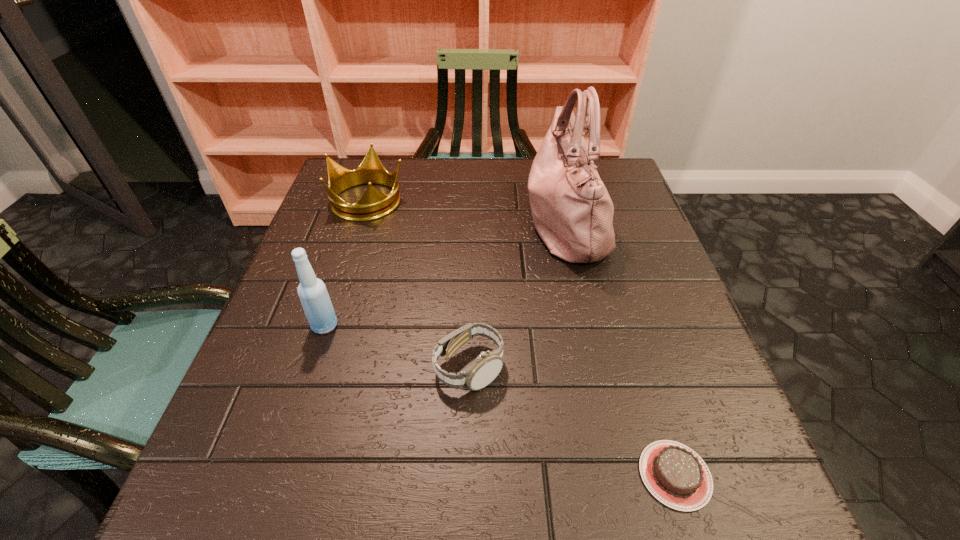
Find the location of a particular element. This screenshot has width=960, height=540. handbag that is at the right edge is located at coordinates (572, 211).

Image resolution: width=960 pixels, height=540 pixels. Identify the location of chocolate cake that is at the right edge. (677, 476).

I want to click on object present at the far left corner, so coord(373,204).

Where is `object present at the far right corner`? This screenshot has width=960, height=540. object present at the far right corner is located at coordinates (572, 211).

Identify the location of object located at the near right corner. (677, 476).

Identify the location of vacant space at the far edge of the desktop. (501, 194).

Locate an element on the screen. vacant space at the near edge of the desktop is located at coordinates (498, 481).

The image size is (960, 540). I want to click on vacant space at the left edge of the desktop, so click(266, 328).

Image resolution: width=960 pixels, height=540 pixels. I want to click on free space at the right edge, so click(x=643, y=314).

I want to click on vacant area at the far left corner of the desktop, so click(x=344, y=195).